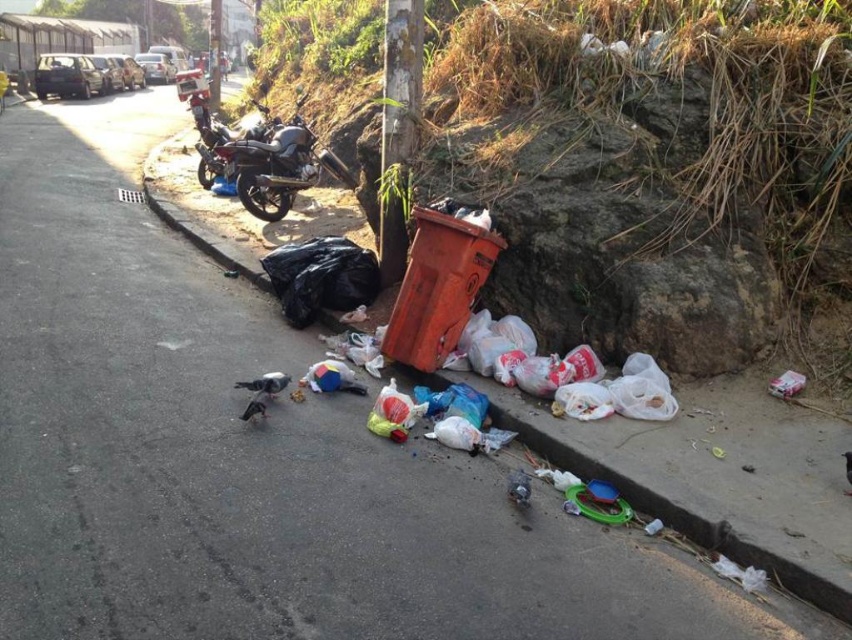
You are a sanitation worker who needs to collect the orange plastic bin at lower right and the black plastic bag at lower left. Which object is shorter in height?

The orange plastic bin at lower right is not as tall as the black plastic bag at lower left, so the orange plastic bin at lower right is shorter in height.